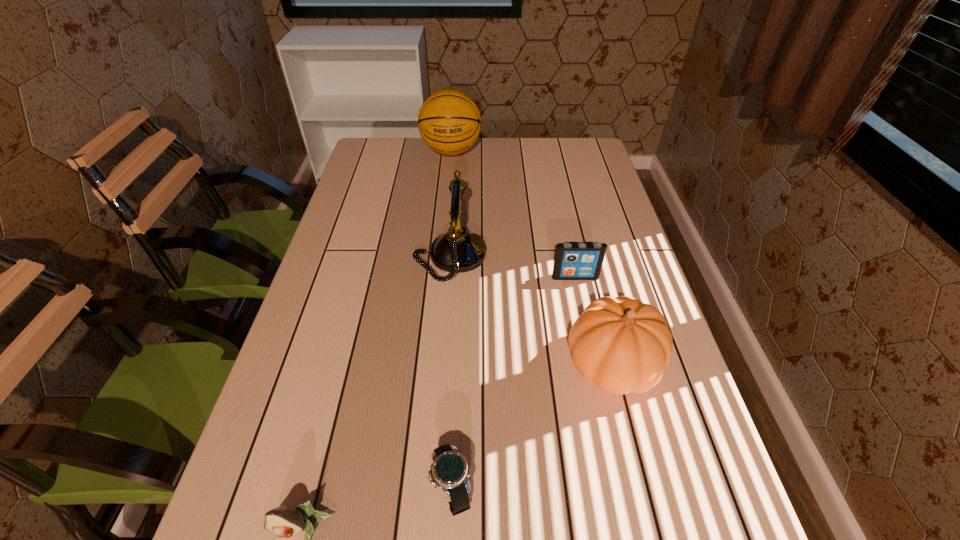
Find the location of a particular element. The width and height of the screenshot is (960, 540). object at the far edge is located at coordinates [449, 121].

Locate an element on the screen. This screenshot has width=960, height=540. pumpkin present at the right edge is located at coordinates (623, 345).

You are a GUI agent. You are given a task and a screenshot of the screen. Output one action in this format:
    pyautogui.click(x=<x>, y=<y>)
    Task: Click on the iPod at the right edge
    Image resolution: width=960 pixels, height=540 pixels.
    Given the screenshot: What is the action you would take?
    pyautogui.click(x=573, y=260)

The height and width of the screenshot is (540, 960). Find the location of `vacant position at the far edge of the desktop`. vacant position at the far edge of the desktop is located at coordinates (549, 172).

Where is `vacant region at the left edge of the desktop`? The height and width of the screenshot is (540, 960). vacant region at the left edge of the desktop is located at coordinates pos(386,183).

You are a GUI agent. You are given a task and a screenshot of the screen. Output one action in this format:
    pyautogui.click(x=<x>, y=<y>)
    Task: Click on the free location at the right edge of the desktop
    
    Given the screenshot: What is the action you would take?
    pyautogui.click(x=638, y=517)

Where is `vacant space at the far left corner`? This screenshot has height=540, width=960. vacant space at the far left corner is located at coordinates (403, 157).

Where is `vacant area that lies between the telephone and the iPod`? This screenshot has width=960, height=540. vacant area that lies between the telephone and the iPod is located at coordinates (513, 267).

Image resolution: width=960 pixels, height=540 pixels. I want to click on free area in between the farthest object and the telephone, so click(x=451, y=204).

I want to click on free space between the farthest object and the iPod, so click(x=514, y=214).